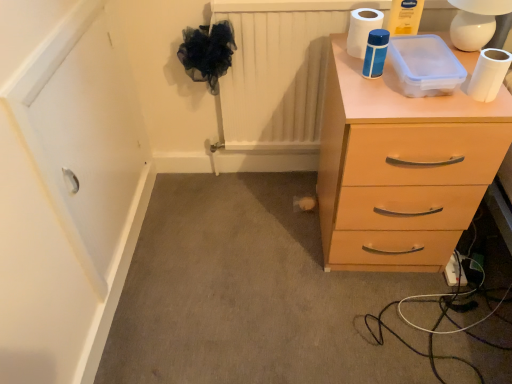
Question: Can you confirm if white matte toilet paper at upper right, arranged as the second toilet paper when viewed from the front, is wider than light wood chest of drawers at right?

Choices:
 (A) yes
 (B) no

Answer: (B)

Question: Can you confirm if white matte toilet paper at upper right, the 1th toilet paper in the top-to-bottom sequence, is positioned to the left of light wood chest of drawers at right?

Choices:
 (A) no
 (B) yes

Answer: (B)

Question: Is white matte toilet paper at upper right, which is the 2th toilet paper in right-to-left order, oriented towards light wood chest of drawers at right?

Choices:
 (A) yes
 (B) no

Answer: (B)

Question: Is white matte toilet paper at upper right, the 1th toilet paper when ordered from left to right, turned away from light wood chest of drawers at right?

Choices:
 (A) yes
 (B) no

Answer: (B)

Question: Is white matte toilet paper at upper right, arranged as the second toilet paper when viewed from the front, closer to the viewer compared to light wood chest of drawers at right?

Choices:
 (A) no
 (B) yes

Answer: (A)

Question: Considering the positions of white plastic extension cord at lower right and white matte toilet paper at upper right, the 1th toilet paper positioned from the front, in the image, is white plastic extension cord at lower right wider or thinner than white matte toilet paper at upper right, the 1th toilet paper positioned from the front,?

Choices:
 (A) thin
 (B) wide

Answer: (B)

Question: Considering their positions, is white plastic extension cord at lower right located in front of or behind white matte toilet paper at upper right, the 2th toilet paper in the top-to-bottom sequence?

Choices:
 (A) behind
 (B) front

Answer: (A)

Question: From their relative heights in the image, would you say white plastic extension cord at lower right is taller or shorter than white matte toilet paper at upper right, positioned as the 2th toilet paper in left-to-right order?

Choices:
 (A) tall
 (B) short

Answer: (B)

Question: From a real-world perspective, relative to white matte toilet paper at upper right, positioned as the 2th toilet paper in left-to-right order, is white plastic extension cord at lower right vertically above or below?

Choices:
 (A) below
 (B) above

Answer: (A)

Question: Is white matte toilet paper at upper right, arranged as the second toilet paper when viewed from the front, spatially inside white plastic extension cord at lower right, or outside of it?

Choices:
 (A) outside
 (B) inside

Answer: (A)

Question: Based on their sizes in the image, would you say white matte toilet paper at upper right, the 1th toilet paper when ordered from left to right, is bigger or smaller than white plastic extension cord at lower right?

Choices:
 (A) small
 (B) big

Answer: (B)

Question: From the image's perspective, is white matte toilet paper at upper right, the first toilet paper from the back, positioned above or below white plastic extension cord at lower right?

Choices:
 (A) above
 (B) below

Answer: (A)

Question: Considering their positions, is white matte toilet paper at upper right, the second toilet paper ordered from the bottom, located in front of or behind white plastic extension cord at lower right?

Choices:
 (A) front
 (B) behind

Answer: (A)

Question: From a real-world perspective, is white matte toilet paper at upper right, the 1th toilet paper from the right, above or below white plastic extension cord at lower right?

Choices:
 (A) below
 (B) above

Answer: (B)

Question: Is white matte toilet paper at upper right, the 1th toilet paper positioned from the front, wider or thinner than white plastic extension cord at lower right?

Choices:
 (A) wide
 (B) thin

Answer: (B)